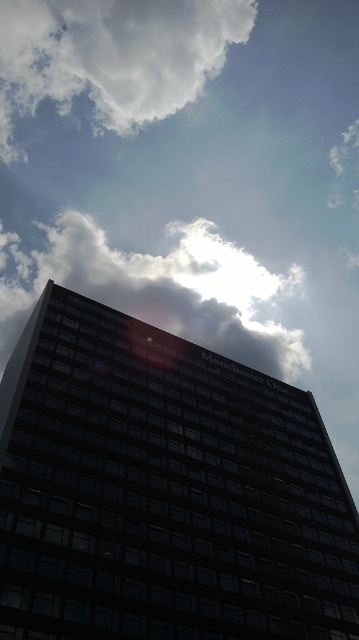
Can you confirm if white fluffy cloud at upper left is positioned to the right of white fluffy cloud at upper center?

Incorrect, white fluffy cloud at upper left is not on the right side of white fluffy cloud at upper center.

Between point (253, 6) and point (159, 320), which one is positioned in front?

Point (159, 320)

At what (x,y) coordinates should I click in order to perform the action: click on white fluffy cloud at upper left. Please return your answer as a coordinate pair (x, y). The width and height of the screenshot is (359, 640). Looking at the image, I should click on (113, 56).